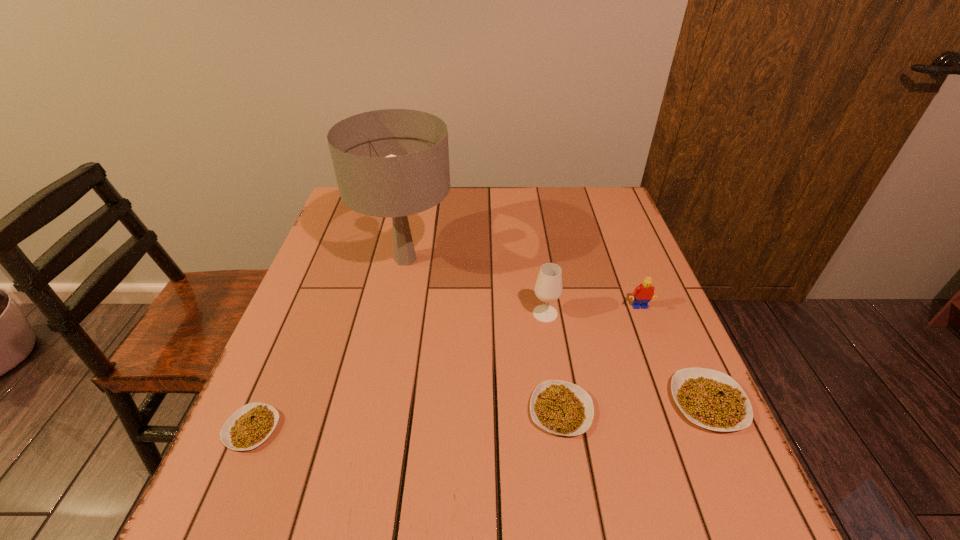
Where is `free space between the second object from left to right and the third shortest object`? This screenshot has width=960, height=540. free space between the second object from left to right and the third shortest object is located at coordinates (557, 330).

The width and height of the screenshot is (960, 540). I want to click on vacant area that lies between the tallest legume and the glass, so click(627, 357).

Locate an element on the screen. The width and height of the screenshot is (960, 540). unoccupied position between the shortest object and the Lego is located at coordinates pos(445,368).

The height and width of the screenshot is (540, 960). I want to click on free space between the second legume from left to right and the leftmost legume, so click(406, 420).

The height and width of the screenshot is (540, 960). In order to click on vacant space that's between the second shortest object and the tallest object in this screenshot , I will do `click(483, 335)`.

The image size is (960, 540). Identify the location of free spot between the farthest object and the shortest object. (328, 344).

Where is `empty space between the fifth tallest object and the fourth shortest object`? empty space between the fifth tallest object and the fourth shortest object is located at coordinates (600, 359).

I want to click on free area in between the leftmost object and the lampshade, so click(x=328, y=344).

Locate which object ranks in proximity to the leftmost legume. Please provide its 2D coordinates. Your answer should be formatted as a tuple, i.e. [(x, y)], where the tuple contains the x and y coordinates of a point satisfying the conditions above.

[(394, 163)]

At what (x,y) coordinates should I click in order to perform the action: click on object that stands as the fifth closest to the Lego. Please return your answer as a coordinate pair (x, y). The width and height of the screenshot is (960, 540). Looking at the image, I should click on 252,424.